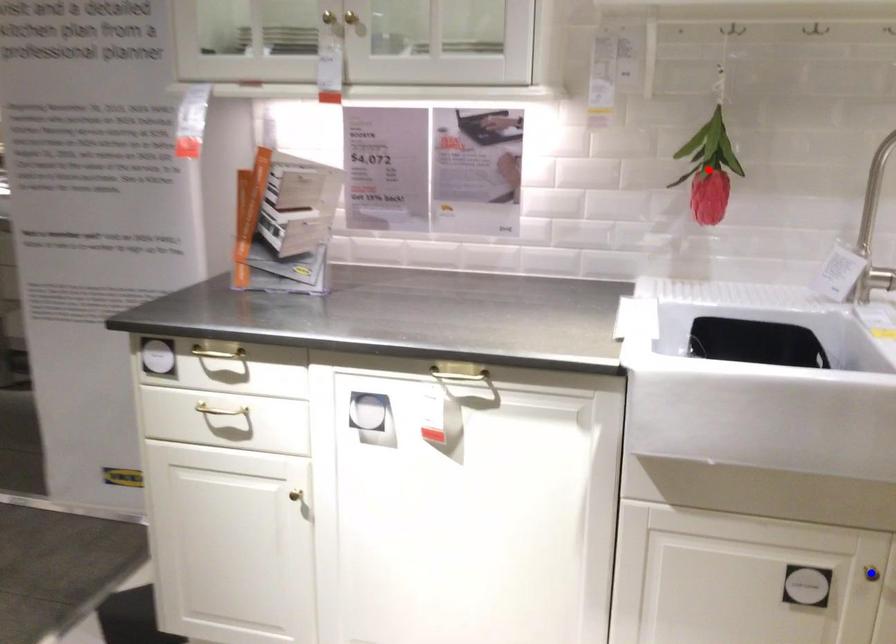
Question: In the image, two points are highlighted. Which point is nearer to the camera? Reply with the corresponding letter.

Choices:
 (A) blue point
 (B) red point

Answer: (A)